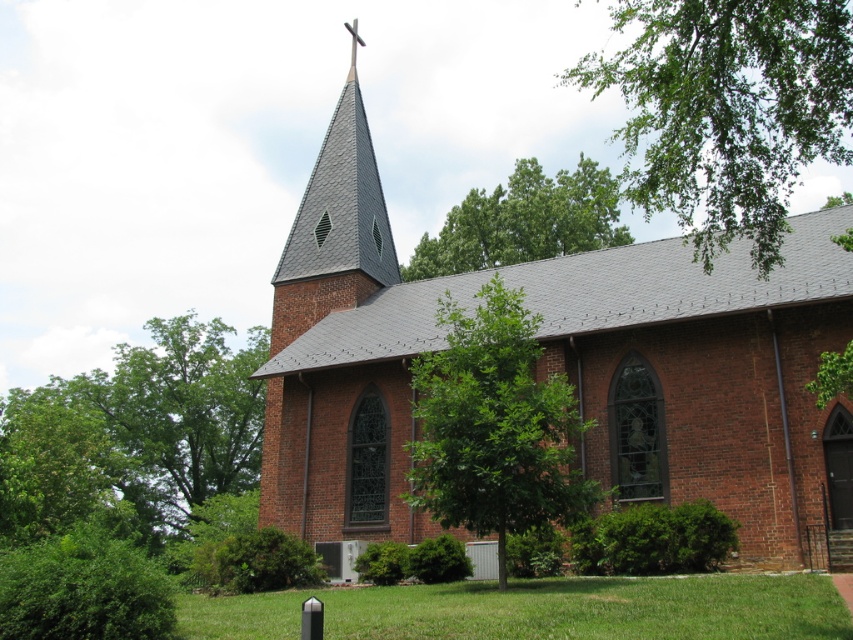
Question: Which of these objects is positioned farthest from the green leafy tree at lower left?

Choices:
 (A) green leafy tree at upper right
 (B) green leafy tree at center
 (C) gray slate spire at upper center
 (D) green leafy tree at upper center

Answer: (A)

Question: Does green leafy tree at left lie behind green leafy tree at lower left?

Choices:
 (A) yes
 (B) no

Answer: (A)

Question: Which is nearer to the green leafy tree at upper center?

Choices:
 (A) green leafy tree at center
 (B) green leafy tree at upper right
 (C) green leafy tree at lower left

Answer: (B)

Question: Does green leafy tree at left have a larger size compared to green leafy tree at upper center?

Choices:
 (A) no
 (B) yes

Answer: (B)

Question: Is green leafy tree at center above green leafy tree at left?

Choices:
 (A) no
 (B) yes

Answer: (B)

Question: Among these objects, which one is nearest to the camera?

Choices:
 (A) green leafy tree at left
 (B) green leafy tree at upper right
 (C) red brick chapel at center
 (D) green leafy tree at upper center

Answer: (B)